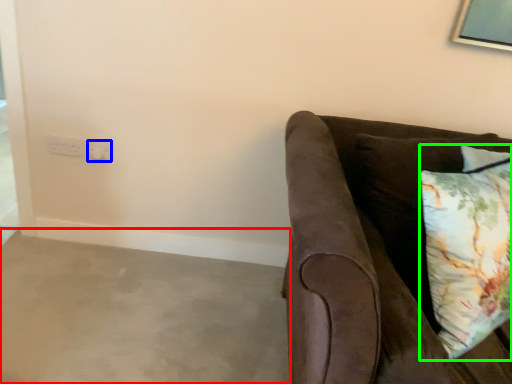
Question: Which is farther away from concrete (highlighted by a red box)? electric outlet (highlighted by a blue box) or pillow (highlighted by a green box)?

Choices:
 (A) electric outlet
 (B) pillow

Answer: (B)